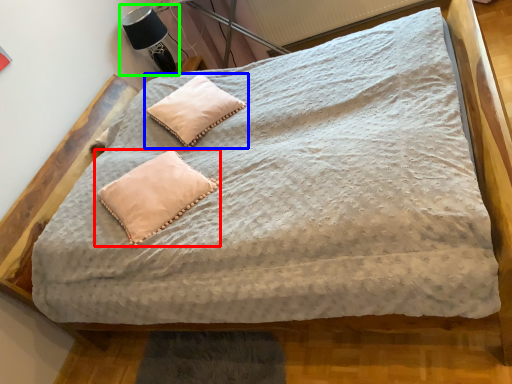
Question: Which object is positioned farthest from pillow (highlighted by a red box)? Select from pillow (highlighted by a blue box) and table lamp (highlighted by a green box).

Choices:
 (A) pillow
 (B) table lamp

Answer: (B)